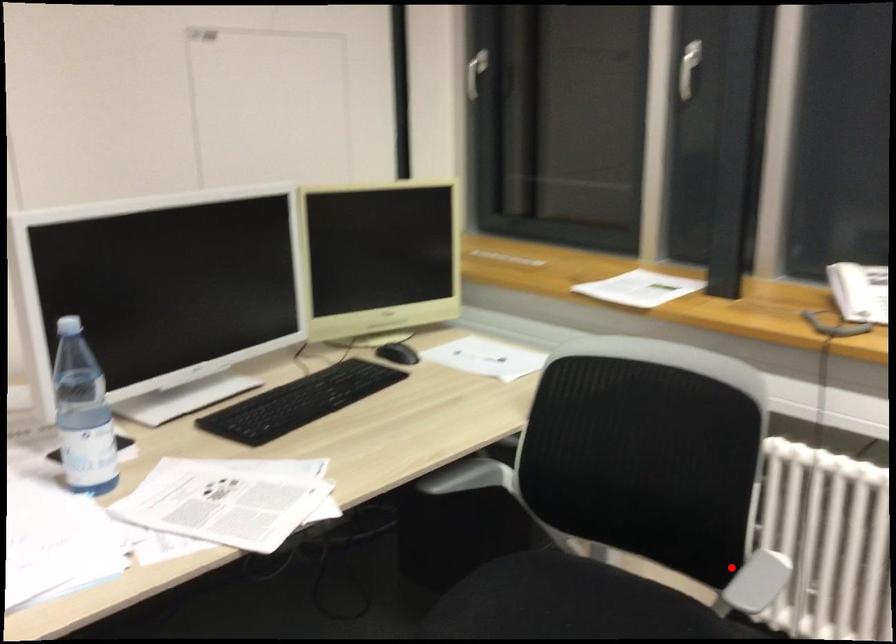
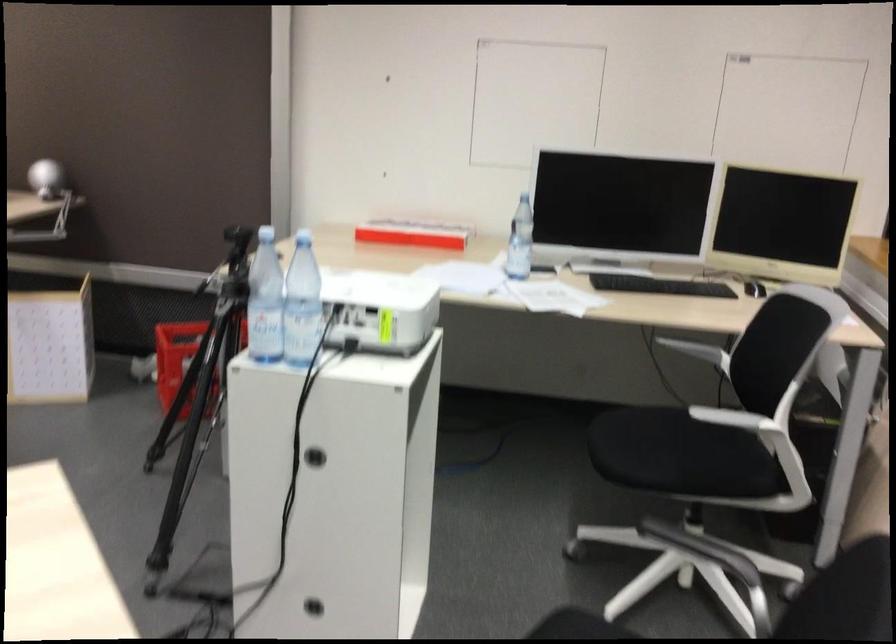
Question: I am providing you with two images of the same scene from different viewpoints. Image1 has a red point marked. In image2, the corresponding 3D location appears at what relative position? Reply with the corresponding letter.

Choices:
 (A) Closer
 (B) Farther

Answer: (B)